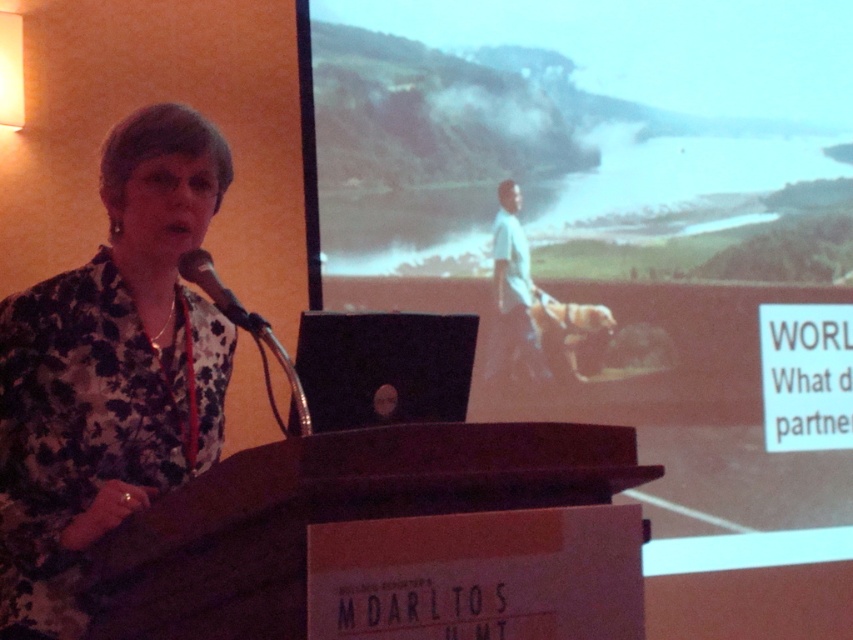
Question: Considering the relative positions of matte black laptop at center and matte black microphone at left in the image provided, where is matte black laptop at center located with respect to matte black microphone at left?

Choices:
 (A) below
 (B) above

Answer: (B)

Question: Which point is farther from the camera taking this photo?

Choices:
 (A) (676, 204)
 (B) (126, 168)

Answer: (A)

Question: Can you confirm if black matte laptop at center is positioned to the right of matte black microphone at left?

Choices:
 (A) no
 (B) yes

Answer: (B)

Question: Can you confirm if matte black laptop at center is positioned below black matte laptop at center?

Choices:
 (A) no
 (B) yes

Answer: (A)

Question: Which of the following is the farthest from the observer?

Choices:
 (A) matte black laptop at center
 (B) floral fabric shirt at left
 (C) black matte laptop at center

Answer: (A)

Question: Which object is farther from the camera taking this photo?

Choices:
 (A) floral fabric shirt at left
 (B) matte black laptop at center
 (C) black matte laptop at center
 (D) matte black microphone at left

Answer: (B)